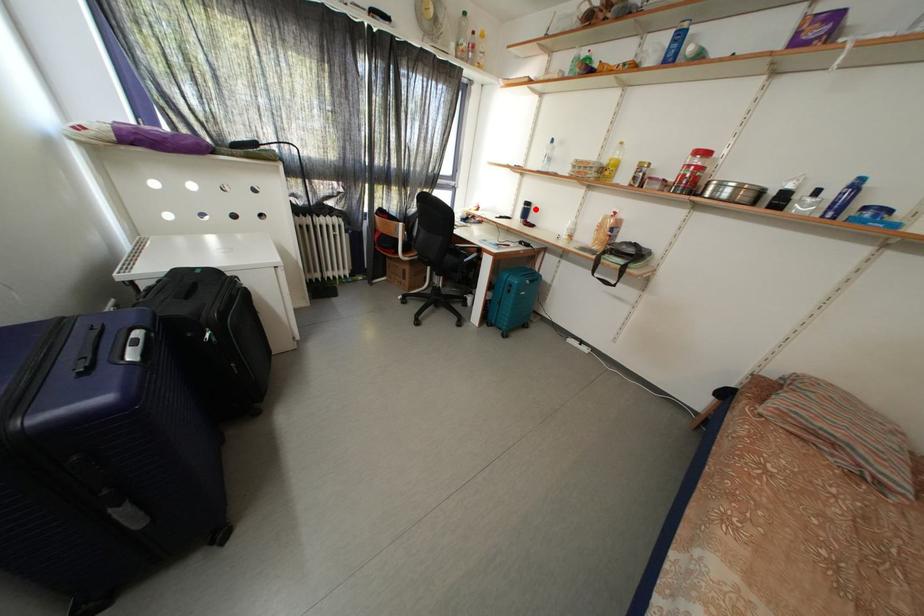
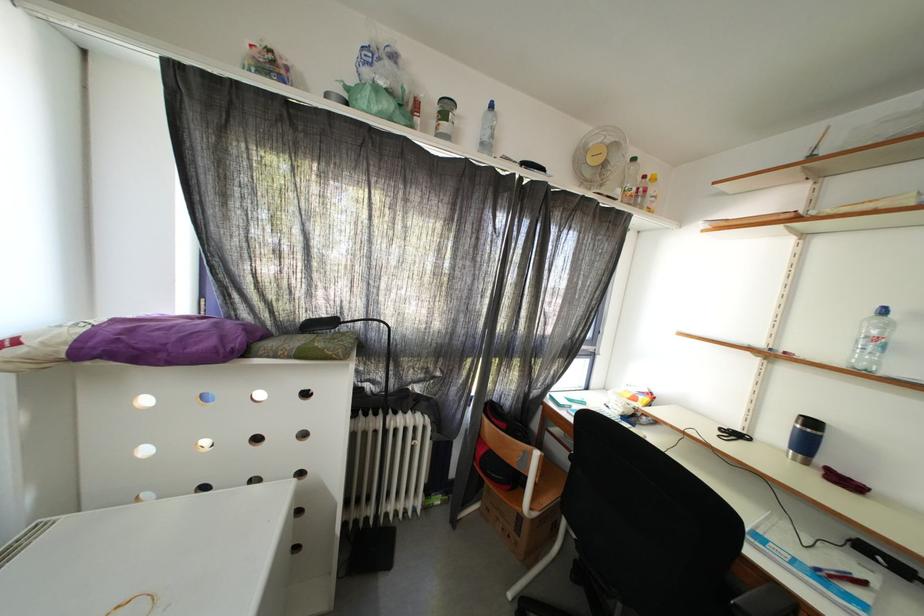
Question: I am providing you with two images of the same scene from different viewpoints. In image1, a red point is highlighted. Considering the same 3D point in image2, which of the following is correct?

Choices:
 (A) It is closer
 (B) It is farther

Answer: (B)